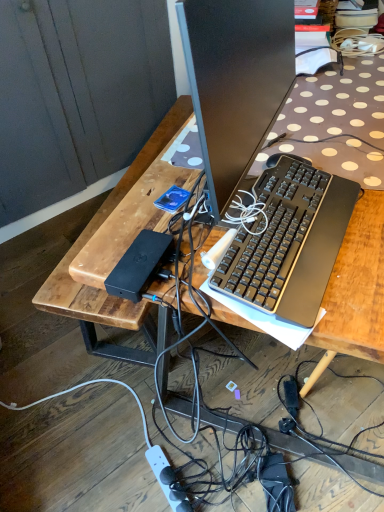
Identify the location of free space above wooden desk at center (from a real-world perspective). (306, 125).